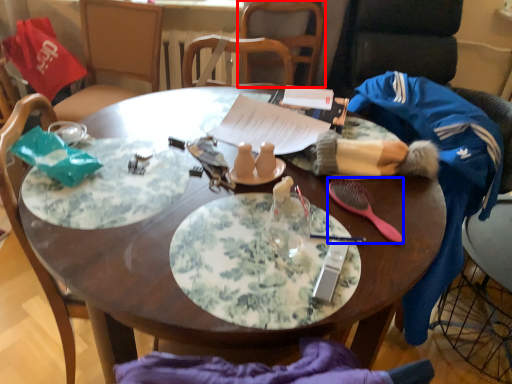
Question: Which object appears closest to the camera in this image, chair (highlighted by a red box) or tableware (highlighted by a blue box)?

Choices:
 (A) chair
 (B) tableware

Answer: (B)